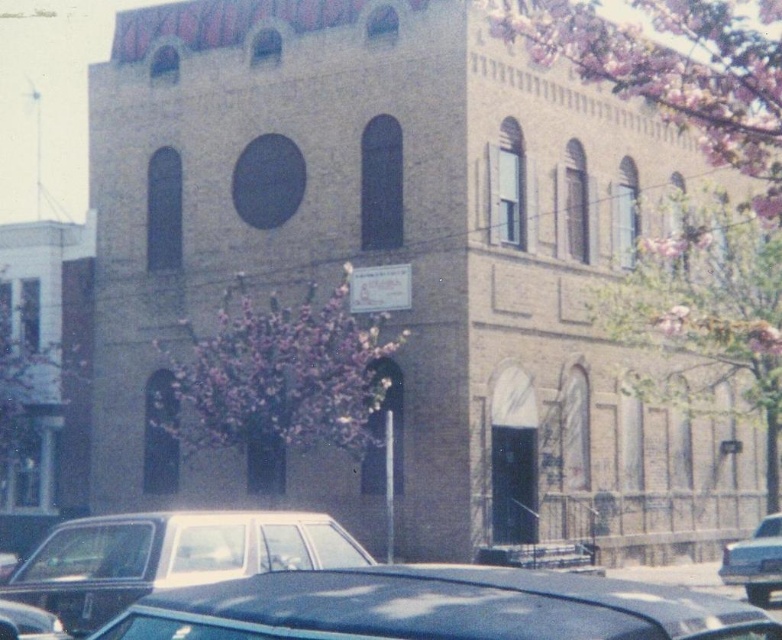
Can you confirm if shiny black car at lower center is thinner than shiny black car at lower left?

No.

Does point (610, 624) come behind point (42, 625)?

That is False.

This screenshot has width=782, height=640. Find the location of `shiny black car at lower center`. shiny black car at lower center is located at coordinates (436, 608).

Does shiny black car at lower center come behind pink blossoms at center?

No, it is in front of pink blossoms at center.

Can you confirm if shiny black car at lower center is positioned above pink blossoms at center?

Actually, shiny black car at lower center is below pink blossoms at center.

This screenshot has width=782, height=640. Find the location of `shiny black car at lower center`. shiny black car at lower center is located at coordinates (436, 608).

In the scene shown: Does pink blossoms at upper center come in front of shiny black car at lower left?

No, pink blossoms at upper center is behind shiny black car at lower left.

Can you confirm if pink blossoms at upper center is bigger than shiny black car at lower left?

Yes.

Who is more distant from viewer, [662,100] or [16,634]?

Point [662,100]

Find the location of `pink blossoms at upper center`. pink blossoms at upper center is located at coordinates (675, 70).